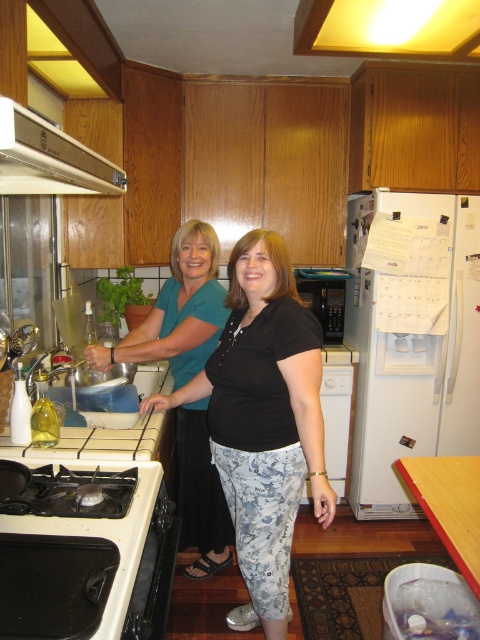
You are standing in the kitchen and want to reach the black matte stove at lower left to adjust the burner. However, the white matte refrigerator at right is blocking your path. Can you move around the refrigerator to access the stove?

The black matte stove at lower left is behind the white matte refrigerator at right, so you can move around the refrigerator to access the stove since it is positioned behind it.

Based on the photo, you are a chef trying to locate the microwave in this kitchen. According to the scene, where is the black matte microwave at center positioned relative to the white glossy exhaust hood at upper left?

The black matte microwave at center is below the white glossy exhaust hood at upper left since the exhaust hood is above it.

You are organizing the kitchen and need to place a new spice rack. The spice rack requires a space that is above the stove but not directly over it. Based on the scene, can the white matte refrigerator at right be placed in this desired location relative to the black matte stove at lower left?

The white matte refrigerator at right is positioned over the black matte stove at lower left, so it can be placed in the desired location as it is above the stove but not directly over it.